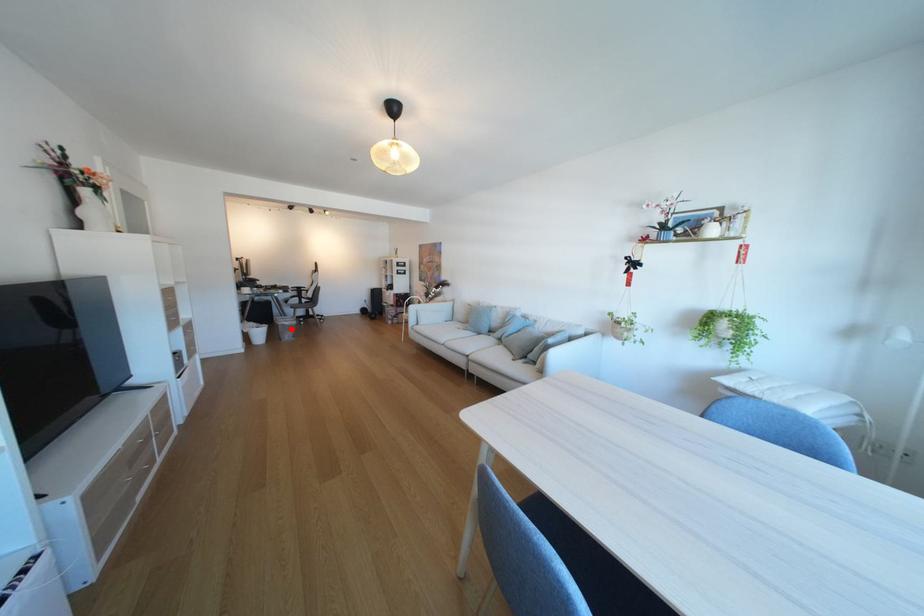
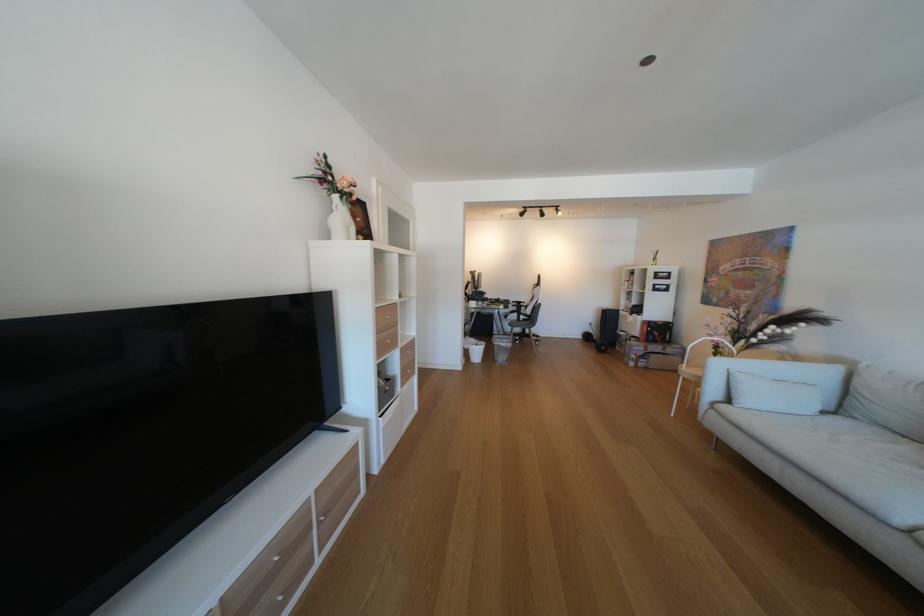
Find the pixel in the second image that matches the highlighted location in the first image.

(506, 349)